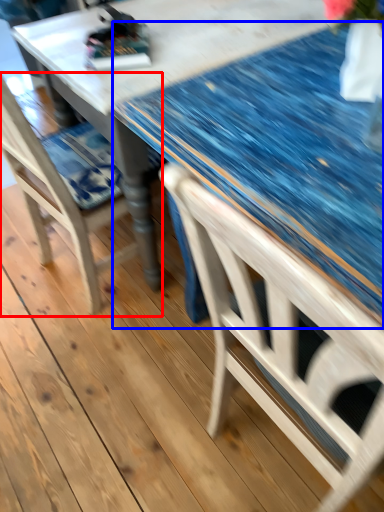
Question: Which object is closer to the camera taking this photo, chair (highlighted by a red box) or glass table (highlighted by a blue box)?

Choices:
 (A) chair
 (B) glass table

Answer: (A)